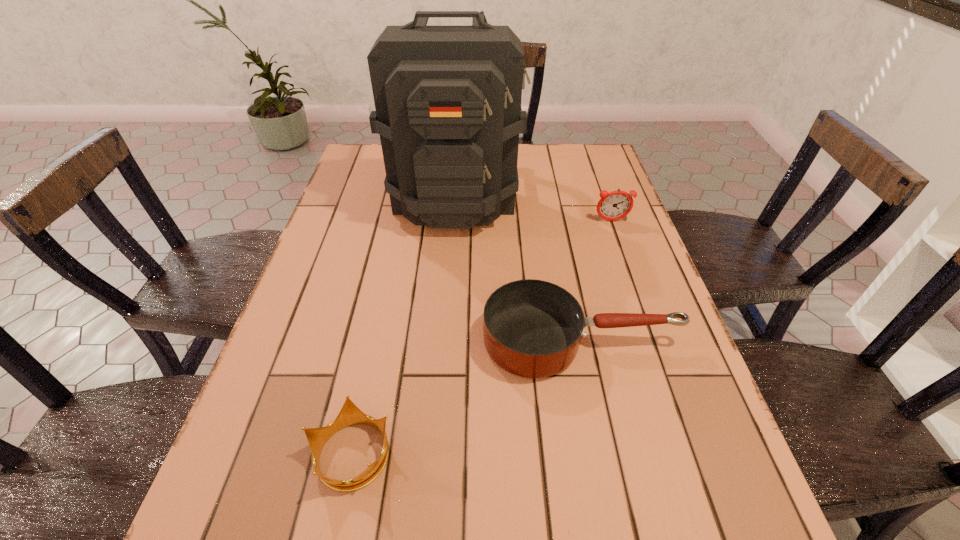
Where is `the tallest object`? The width and height of the screenshot is (960, 540). the tallest object is located at coordinates (448, 109).

I want to click on alarm clock, so click(x=615, y=205).

This screenshot has height=540, width=960. Identify the location of pan. (532, 328).

You are a GUI agent. You are given a task and a screenshot of the screen. Output one action in this format:
    pyautogui.click(x=<x>, y=<y>)
    Task: Click on the nearest object
    This screenshot has width=960, height=540.
    Given the screenshot: What is the action you would take?
    pyautogui.click(x=350, y=414)

Find the location of a particular element. free spot located on the front compartment of the backpack is located at coordinates tap(444, 346).

Find the location of a particular element. This screenshot has height=540, width=960. blank area located 0.170m on the front-facing side of the alarm clock is located at coordinates (627, 264).

Identify the location of vacant area located on the back of the crown. pos(380,318).

Identify the location of object present at the far edge. This screenshot has height=540, width=960. pos(448,109).

Identify the location of backpack present at the left edge. Image resolution: width=960 pixels, height=540 pixels. (448, 109).

Find the location of a particular element. The height and width of the screenshot is (540, 960). crown located in the left edge section of the desktop is located at coordinates (350, 414).